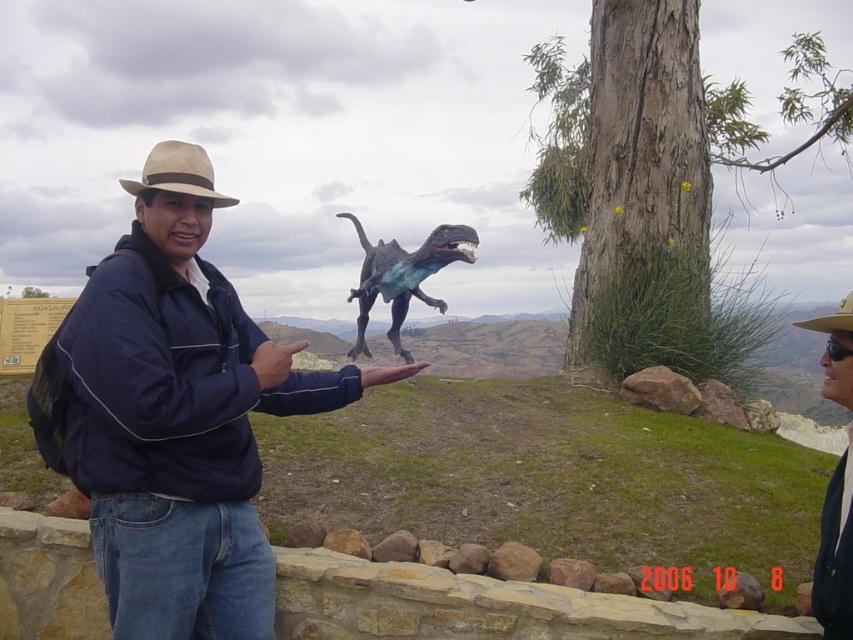
Question: Which point is farther from the camera taking this photo?

Choices:
 (A) (148, 179)
 (B) (201, 225)
 (C) (833, 317)

Answer: (B)

Question: From the image, what is the correct spatial relationship of beige straw cowboy hat at upper left in relation to matte skin hand at center?

Choices:
 (A) left
 (B) right

Answer: (A)

Question: Which object appears farthest from the camera in this image?

Choices:
 (A) matte black jacket at lower right
 (B) matte brown rock at lower left

Answer: (B)

Question: Is beige straw cowboy hat at upper left to the left of matte brown rock at lower left from the viewer's perspective?

Choices:
 (A) yes
 (B) no

Answer: (B)

Question: Estimate the real-world distances between objects in this image. Which object is closer to the blue denim jeans at center?

Choices:
 (A) matte brown rock at lower left
 (B) shiny metallic dinosaur at center
 (C) brown straw cowboy hat at upper center

Answer: (A)

Question: Does blue denim jeans at center have a smaller size compared to shiny metallic dinosaur at center?

Choices:
 (A) no
 (B) yes

Answer: (B)